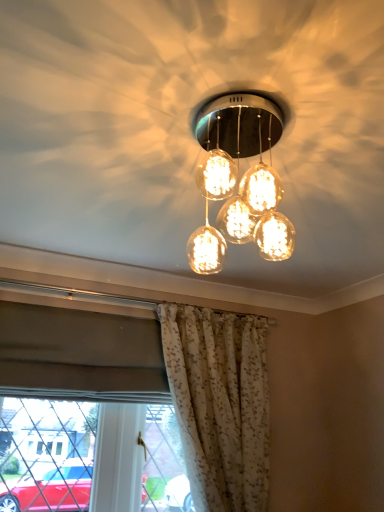
Question: Is white floral fabric curtain at lower center to the right of translucent glass globe at center from the viewer's perspective?

Choices:
 (A) no
 (B) yes

Answer: (B)

Question: Considering the relative sizes of white floral fabric curtain at lower center and translucent glass globe at center in the image provided, is white floral fabric curtain at lower center smaller than translucent glass globe at center?

Choices:
 (A) yes
 (B) no

Answer: (B)

Question: Would you say white floral fabric curtain at lower center contains translucent glass globe at center?

Choices:
 (A) no
 (B) yes

Answer: (A)

Question: Considering the relative sizes of white floral fabric curtain at lower center and translucent glass globe at center in the image provided, is white floral fabric curtain at lower center thinner than translucent glass globe at center?

Choices:
 (A) yes
 (B) no

Answer: (A)

Question: Is white floral fabric curtain at lower center beside translucent glass globe at center?

Choices:
 (A) no
 (B) yes

Answer: (A)

Question: Does white floral fabric curtain at lower center have a greater width compared to translucent glass globe at center?

Choices:
 (A) no
 (B) yes

Answer: (A)

Question: From a real-world perspective, is translucent glass globe at center under white floral fabric curtain at lower center?

Choices:
 (A) yes
 (B) no

Answer: (B)

Question: Considering the relative positions of translucent glass globe at center and white floral fabric curtain at lower center in the image provided, is translucent glass globe at center to the right of white floral fabric curtain at lower center from the viewer's perspective?

Choices:
 (A) no
 (B) yes

Answer: (A)

Question: Is translucent glass globe at center facing towards white floral fabric curtain at lower center?

Choices:
 (A) no
 (B) yes

Answer: (A)

Question: Does translucent glass globe at center have a larger size compared to white floral fabric curtain at lower center?

Choices:
 (A) no
 (B) yes

Answer: (A)

Question: Is translucent glass globe at center not close to white floral fabric curtain at lower center?

Choices:
 (A) no
 (B) yes

Answer: (B)

Question: Would you say translucent glass globe at center is outside white floral fabric curtain at lower center?

Choices:
 (A) yes
 (B) no

Answer: (A)

Question: In terms of height, does translucent glass globe at center look taller or shorter compared to white floral fabric curtain at lower center?

Choices:
 (A) short
 (B) tall

Answer: (A)